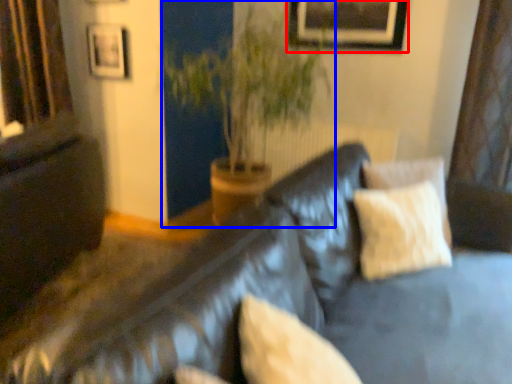
Question: Which of the following is the farthest to the observer, picture frame (highlighted by a red box) or houseplant (highlighted by a blue box)?

Choices:
 (A) picture frame
 (B) houseplant

Answer: (A)